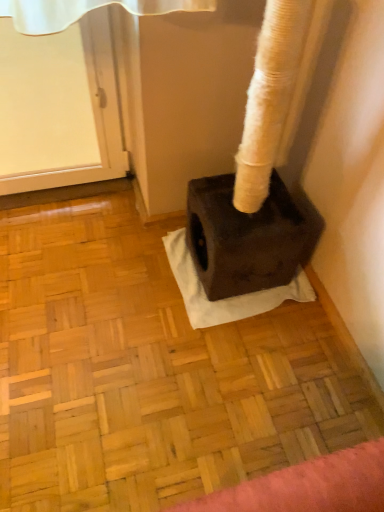
Locate an element on the screen. The width and height of the screenshot is (384, 512). dark gray fabric at center is located at coordinates [x=226, y=298].

What do you see at coordinates (226, 298) in the screenshot?
I see `dark gray fabric at center` at bounding box center [226, 298].

Measure the distance between point (300,293) and camera.

1.49 meters.

At what (x,y) coordinates should I click in order to perform the action: click on dark gray fabric at center. Please return your answer as a coordinate pair (x, y). This screenshot has height=512, width=384. Looking at the image, I should click on (226, 298).